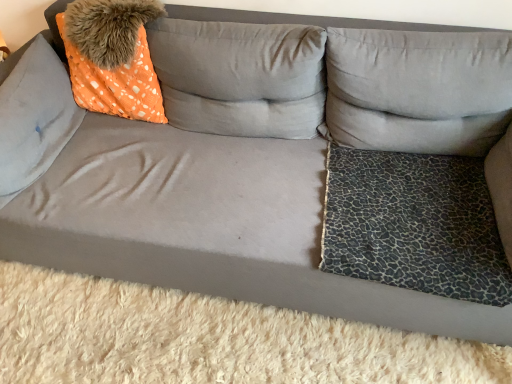
Question: Is orange dotted fabric at upper left spatially inside leopard print fabric dog bed at lower right, or outside of it?

Choices:
 (A) outside
 (B) inside

Answer: (A)

Question: Considering the positions of point (136, 9) and point (448, 168), is point (136, 9) closer or farther from the camera than point (448, 168)?

Choices:
 (A) closer
 (B) farther

Answer: (A)

Question: Which object is the closest to the leopard print fabric dog bed at lower right?

Choices:
 (A) leopard print fabric pillow at right, which is the third pillow from left to right
 (B) orange dotted fabric at upper left
 (C) suede orange pillow at left, acting as the 1th pillow starting from the left
 (D) orange dotted fabric pillow at upper left, which is the 2th pillow in right-to-left order

Answer: (A)

Question: Estimate the real-world distances between objects in this image. Which object is farther from the orange dotted fabric at upper left?

Choices:
 (A) suede orange pillow at left, acting as the 1th pillow starting from the left
 (B) leopard print fabric dog bed at lower right
 (C) orange dotted fabric pillow at upper left, acting as the second pillow starting from the left
 (D) leopard print fabric pillow at right, which is the third pillow from left to right

Answer: (B)